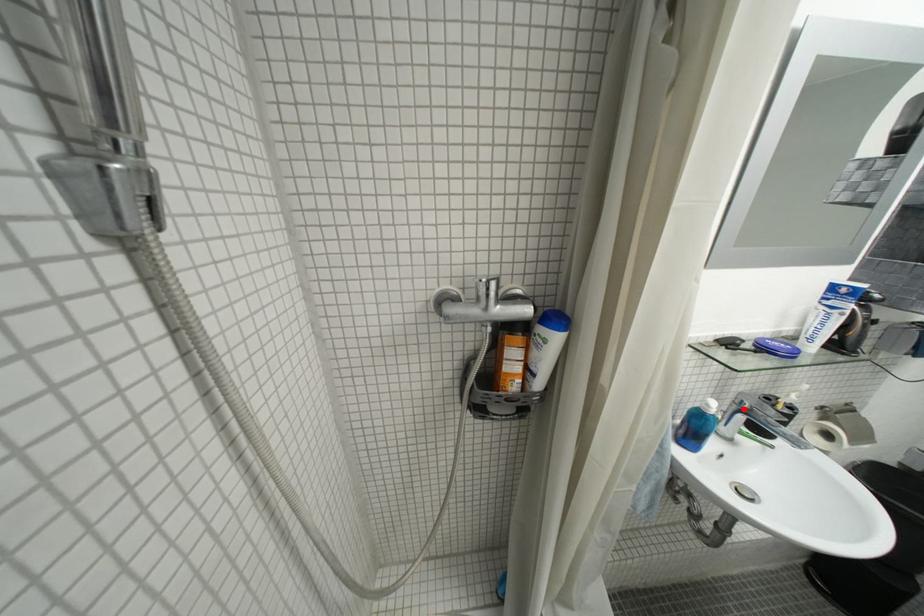
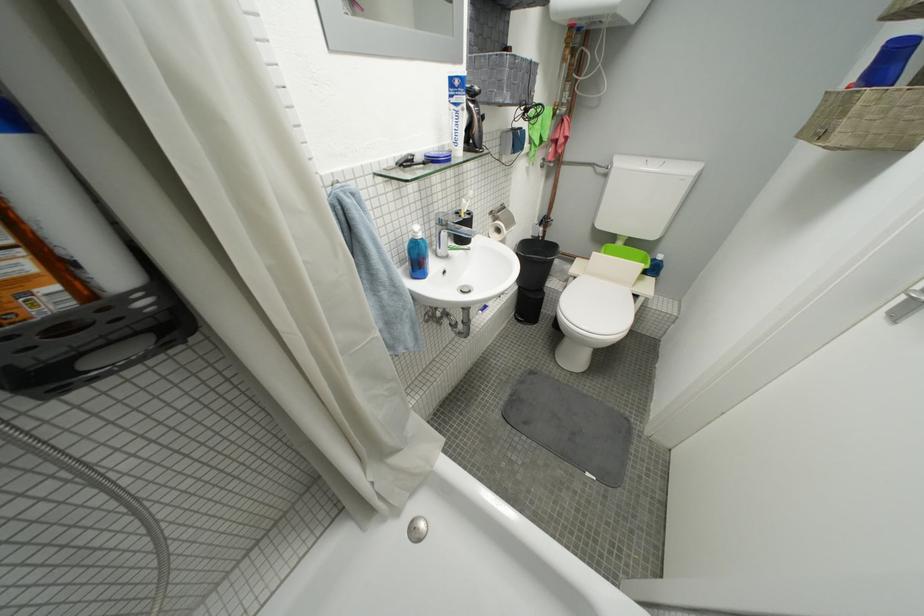
Locate, in the second image, the point that corresponds to the highlighted location in the first image.

(447, 230)